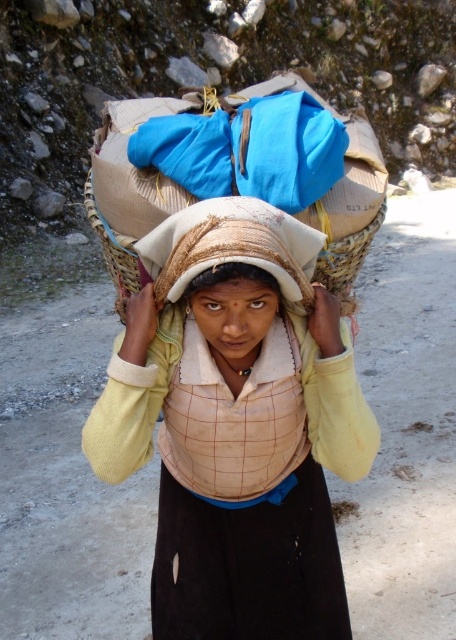
In the scene shown: Based on the scene described, which object at the center is bigger in size between the light beige woven cloth at center and the woven straw basket at center?

The light beige woven cloth at center is larger in size than the woven straw basket at center according to the description.

You are standing 1.5 meters away from the camera. There is a point at coordinates point (250, 353). Is the point closer to you than the camera?

The distance of point (250, 353) from camera is 1.39 meters, so the point is closer to you than the camera because you are 1.5 meters away from the camera and the point is only 1.39 meters away from it.